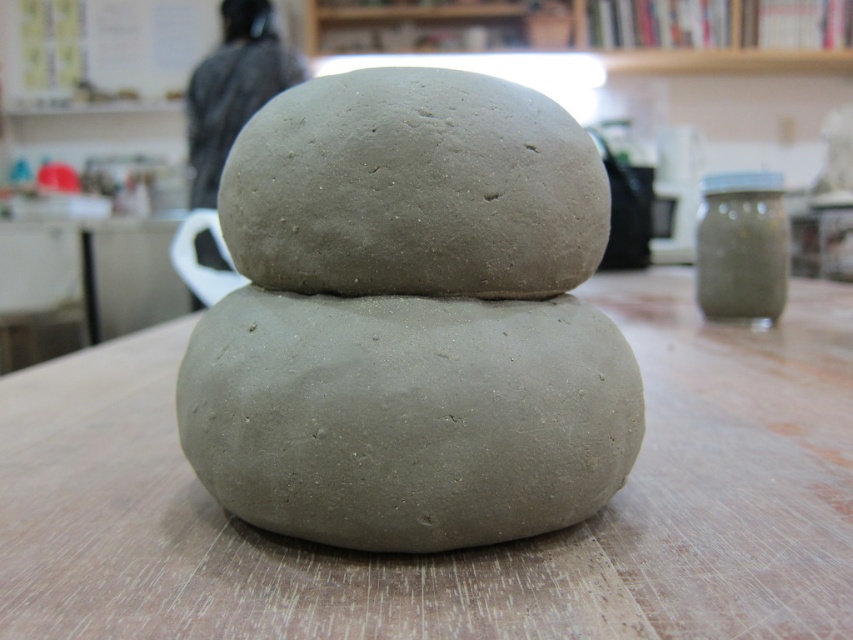
You are an artist working in a studio and need to place a 30 cm long tool between the matte gray clay at center and the gray matte stone at center. Can the tool fit between them without touching either object?

The distance between the matte gray clay at center and the gray matte stone at center is 33.79 centimeters. Since the tool is 30 cm long, there is enough space to place it between them without touching either object.

You are standing in a studio and see a point marked at coordinates (584,609). If you want to place a 30 centimeter wide sculpture exactly at that point, will there be enough space between you and the point to work comfortably?

The distance between you and the point marked at coordinates (584,609) is 61.30 centimeters. Since the sculpture is 30 centimeters wide, there is sufficient space to work comfortably as the distance exceeds the sculpture width.